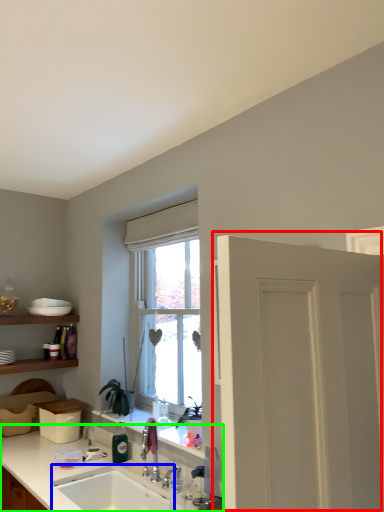
Question: Considering the real-world distances, which object is farthest from door (highlighted by a red box)? sink (highlighted by a blue box) or countertop (highlighted by a green box)?

Choices:
 (A) sink
 (B) countertop

Answer: (A)